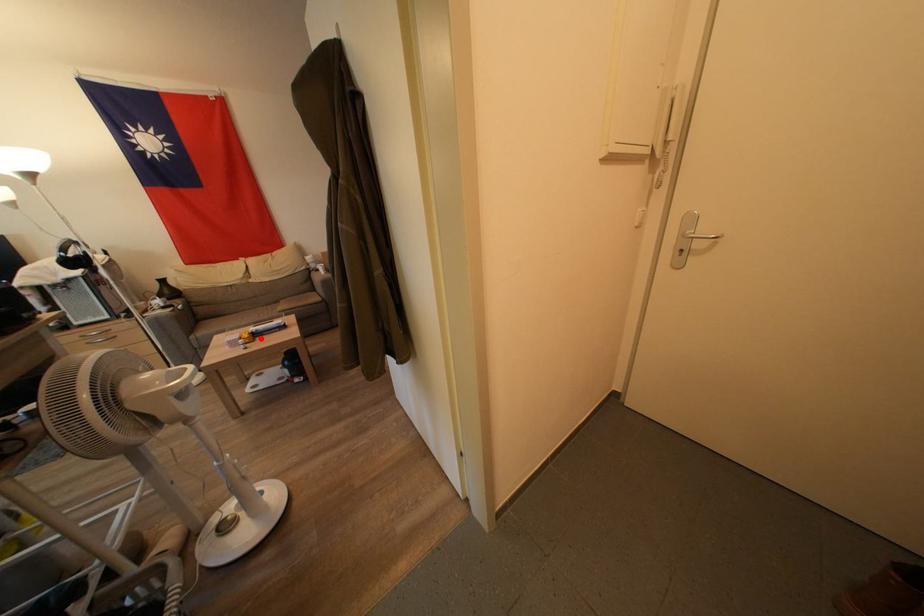
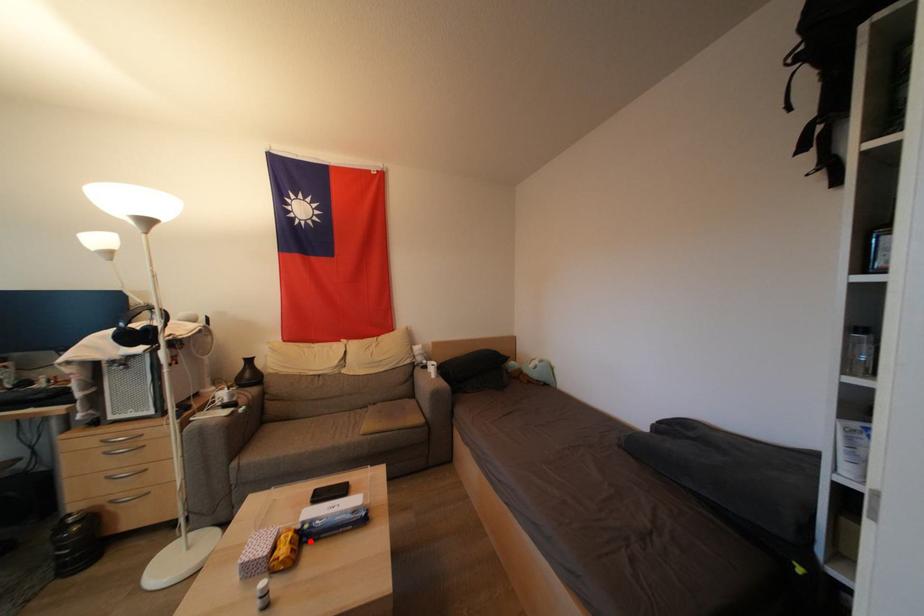
I am providing you with two images of the same scene from different viewpoints. A red point is marked on the first image and another point is marked on the second image. Is the red point in image1 aligned with the point shown in image2?

Yes